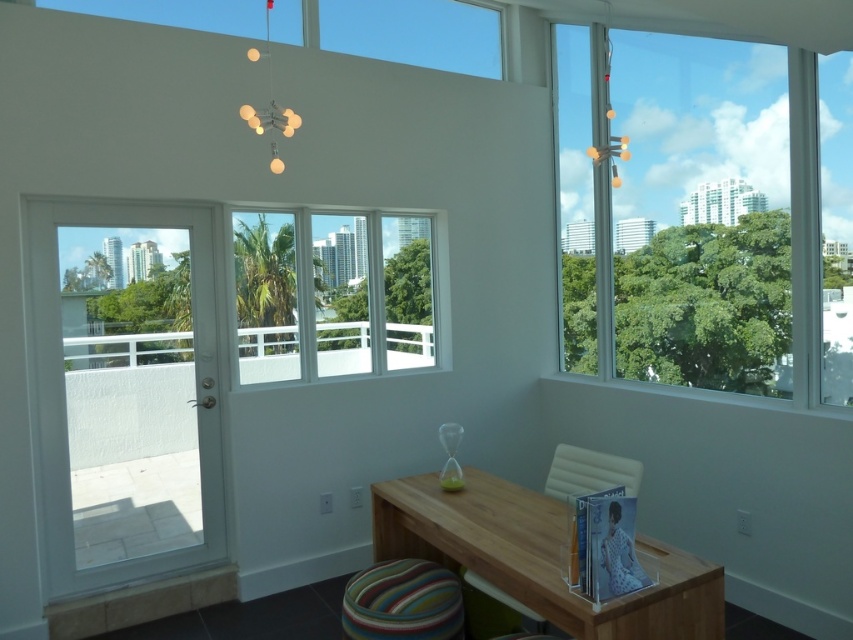
Question: Can you confirm if striped fabric stool at lower center is bigger than white plastic chair at center?

Choices:
 (A) no
 (B) yes

Answer: (B)

Question: Which object appears farthest from the camera in this image?

Choices:
 (A) white glass door at left
 (B) transparent glass window at upper right
 (C) wooden table at center
 (D) striped fabric stool at lower center

Answer: (A)

Question: Does white glass door at left have a smaller size compared to striped fabric stool at lower center?

Choices:
 (A) no
 (B) yes

Answer: (A)

Question: Which of the following is the farthest from the observer?

Choices:
 (A) (511, 516)
 (B) (405, 582)

Answer: (B)

Question: Which object is farther from the camera taking this photo?

Choices:
 (A) striped fabric stool at lower center
 (B) white glass door at left
 (C) white glass window at center
 (D) wooden table at center

Answer: (C)

Question: Is white glass window at center positioned before striped fabric stool at lower center?

Choices:
 (A) yes
 (B) no

Answer: (B)